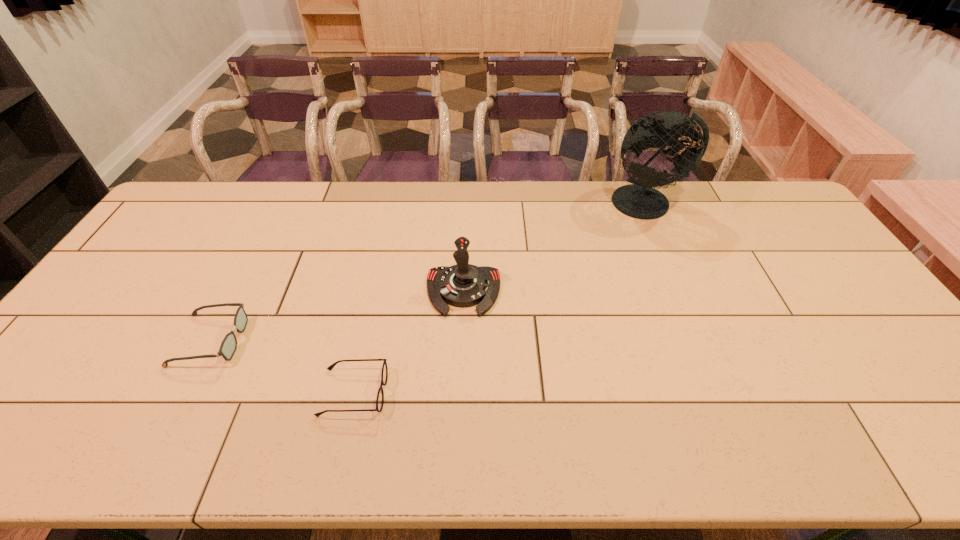
Find the location of a particular element. Image resolution: width=960 pixels, height=540 pixels. vacant space that satisfies the following two spatial constraints: 1. on the handle side of the joystick; 2. on the front-facing side of the shorter spectacles is located at coordinates (460, 393).

Where is `vacant space that satisfies the following two spatial constraints: 1. on the front-facing side of the rightmost object; 2. on the front-facing side of the shorter spectacles`? This screenshot has height=540, width=960. vacant space that satisfies the following two spatial constraints: 1. on the front-facing side of the rightmost object; 2. on the front-facing side of the shorter spectacles is located at coordinates (731, 393).

The height and width of the screenshot is (540, 960). I want to click on vacant region that satisfies the following two spatial constraints: 1. on the front-facing side of the farthest object; 2. on the front-facing side of the shorter spectacles, so click(731, 393).

Where is `free space that satisfies the following two spatial constraints: 1. on the front-facing side of the rightmost object; 2. on the front-facing side of the shorter spectacles`? The height and width of the screenshot is (540, 960). free space that satisfies the following two spatial constraints: 1. on the front-facing side of the rightmost object; 2. on the front-facing side of the shorter spectacles is located at coordinates (731, 393).

I want to click on vacant space that satisfies the following two spatial constraints: 1. on the front-facing side of the tallest object; 2. on the front-facing side of the shortest object, so click(731, 393).

Find the location of a particular element. The height and width of the screenshot is (540, 960). free space that satisfies the following two spatial constraints: 1. on the front-facing side of the rightmost object; 2. on the front-facing side of the shorter spectacles is located at coordinates (731, 393).